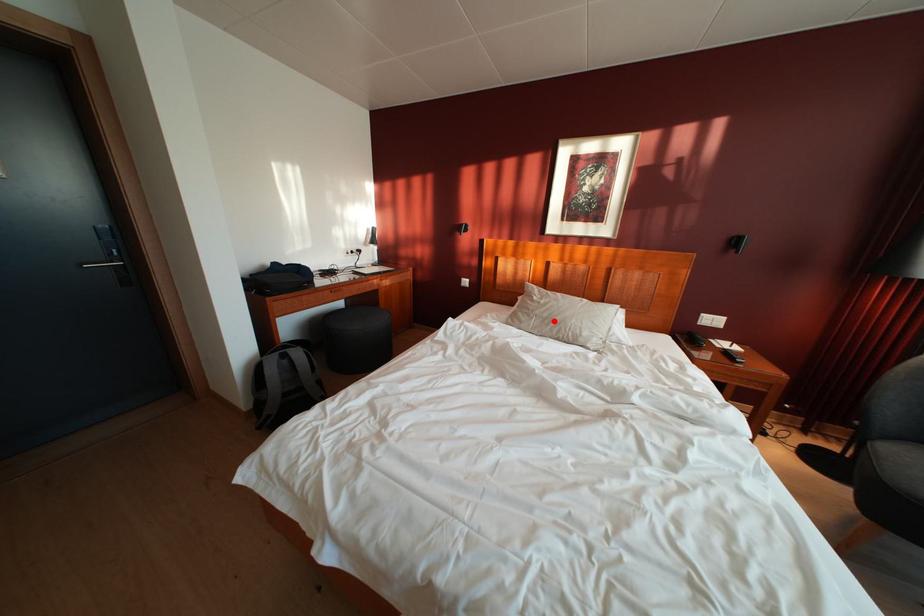
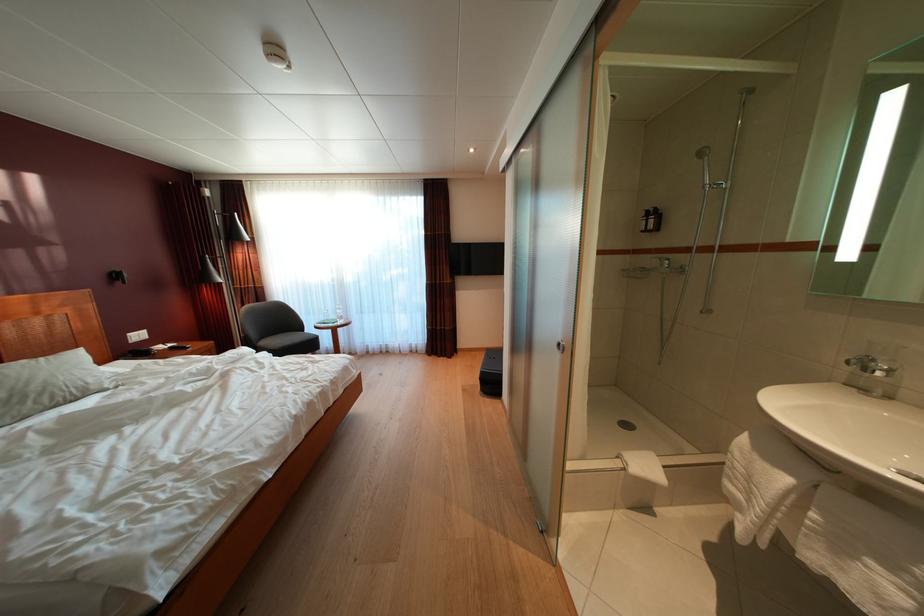
Where in the second image is the point corresponding to the highlighted location from the first image?

(10, 400)